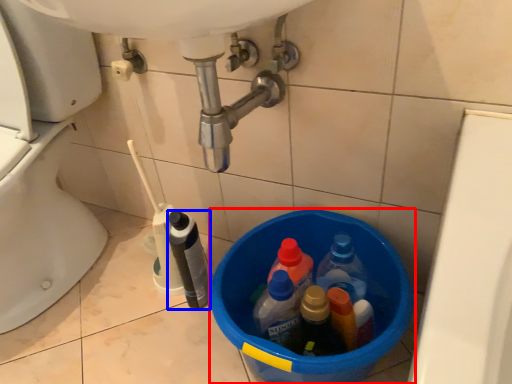
Question: Which of the following is the farthest to the observer, basin (highlighted by a red box) or bottle (highlighted by a blue box)?

Choices:
 (A) basin
 (B) bottle

Answer: (B)